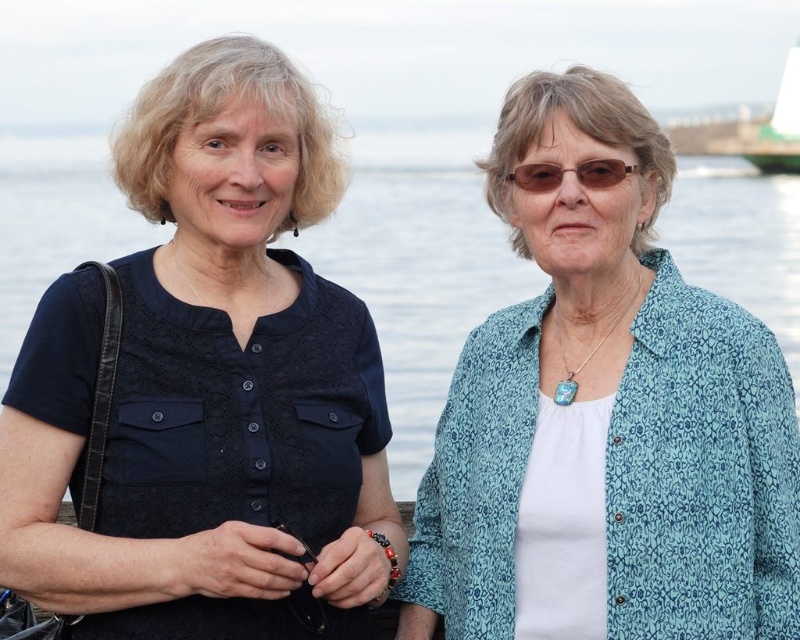
From the picture: You are a photographer standing at the center of the scene. You want to take a photo of both the blue patterned shirt at right and the brown plastic glasses at center without moving either object. Can you fit both into your camera frame that has a maximum width of 3 meters?

The distance between the blue patterned shirt at right and the brown plastic glasses at center is 2.79 meters, which is less than the camera frame width of 3 meters. Therefore, both can be captured in the same frame.

You are a photographer trying to capture a shot of the two women. The blue patterned shirt at right and transparent water at center are in your frame. Based on their positions, which object is closer to the right edge of the photo?

The blue patterned shirt at right is closer to the right edge of the photo because it is positioned to the right of the transparent water at center.

You are a photographer trying to capture a clear shot of the brown plastic glasses at center. However, the blue patterned shirt at right is blocking your view. Can you adjust your position to see the glasses without moving the objects?

The blue patterned shirt at right is in front of the brown plastic glasses at center, so you can move to the left side to see the glasses behind the shirt.